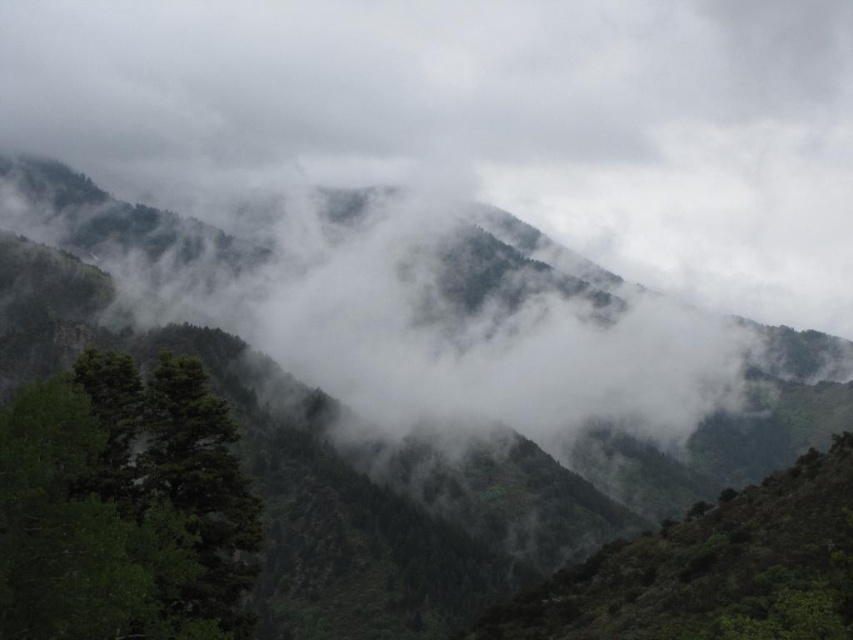
You are a hiker who wants to take a photo of the green matte tree at lower left without the white fluffy cloud at upper center blocking the view. Is the tree visible from your current position?

The white fluffy cloud at upper center is much taller than the green matte tree at lower left, so the cloud may block the view of the tree depending on your angle. However, since the tree is at lower left and the cloud is at upper center, you might be able to position yourself to capture the tree without the cloud obscuring it by moving to a lower elevation or adjusting your camera angle.

What are the coordinates of the white fluffy cloud at upper center in the mountainous landscape?

The white fluffy cloud at upper center is located at point (480, 120).

You are a hiker trying to navigate through the misty mountain landscape. You see the green matte tree at lower left and the white fluffy cloud at upper center. Which object is closer to you from your current viewpoint?

The green matte tree at lower left is behind the white fluffy cloud at upper center, so the white fluffy cloud at upper center is closer to you.